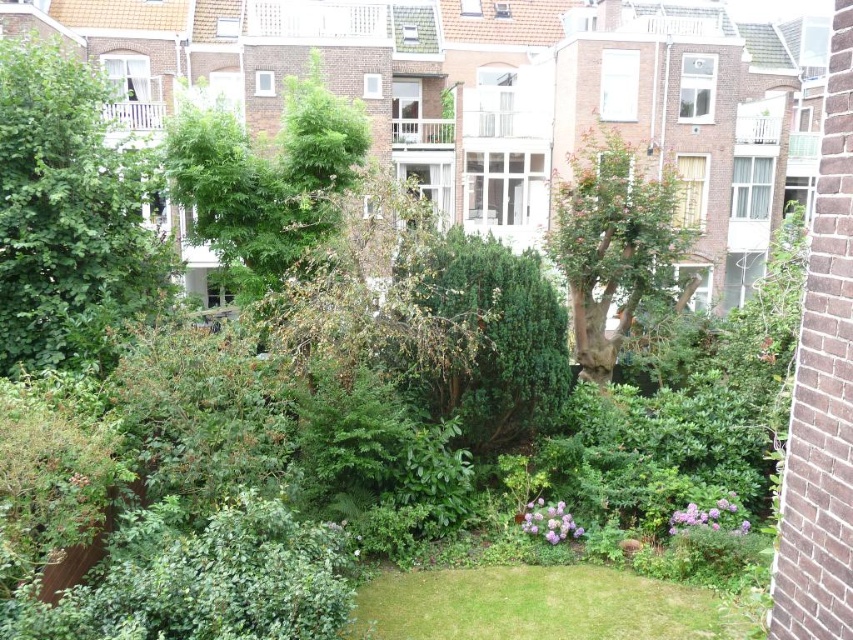
You are a gardener standing in the garden and want to water both the green grass at lower center and the green leafy tree at center. Which object should you water first if you want to start with the one closer to you?

The green grass at lower center is in front of the green leafy tree at center, so you should water the green grass at lower center first since it is closer to you.

You are a gardener planning to mow the green grass at lower center and trim the green leafy tree at center. Which task requires more time considering their sizes?

The green leafy tree at center requires more time to trim than the green grass at lower center because it is larger in size.

You are a gardener who needs to trim plants in the garden. You have a small pruning tool that can only handle plants up to 1 meter in height. Looking at the green leafy bush at center and the green grass at lower center, which plant can you safely trim with your tool?

The green grass at lower center can be safely trimmed with the small pruning tool since it is smaller in size compared to the green leafy bush at center, which may exceed the tool capacity.